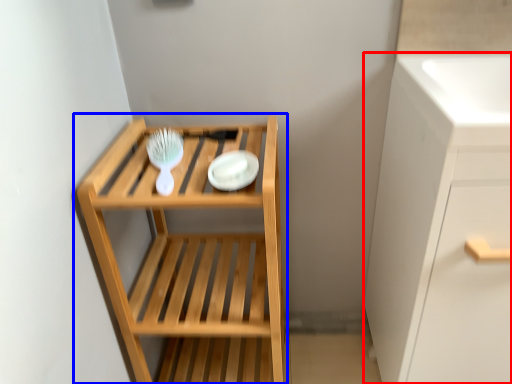
Question: Which object appears closest to the camera in this image, cabinetry (highlighted by a red box) or shelf (highlighted by a blue box)?

Choices:
 (A) cabinetry
 (B) shelf

Answer: (A)